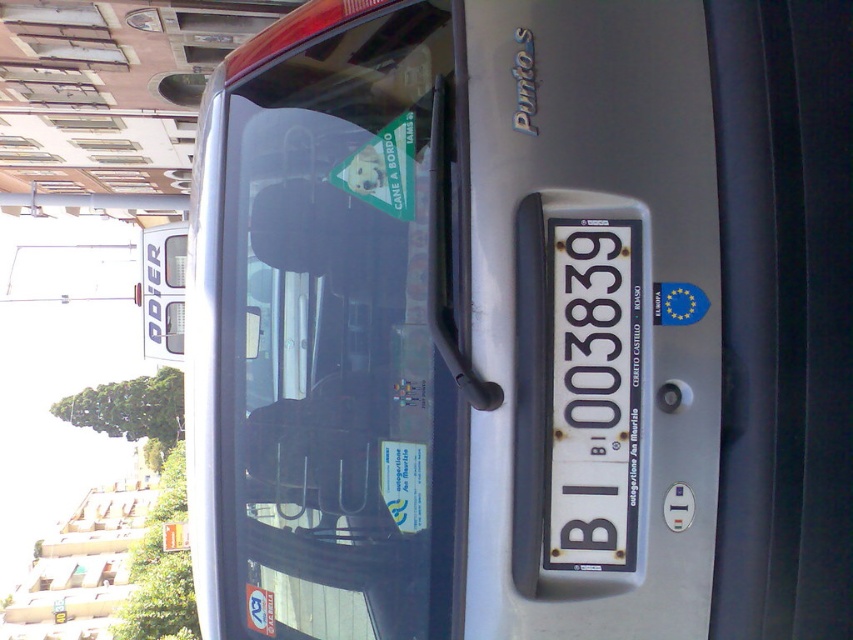
You are a parking attendant checking the license plate and sticker on a car. The car has a white metallic license plate at center and a white paper sticker at center. According to the rules, the license plate must be to the left of the sticker. Is this car compliant with the rule?

The white metallic license plate at center is positioned on the right side of white paper sticker at center, so it is not compliant with the rule that requires the license plate to be to the left of the sticker.

You are a delivery person who needs to confirm the license plate number of the car. You see the white metallic license plate at center and the white paper sticker at center. Which one is higher up?

The white metallic license plate at center is above the white paper sticker at center, so the license plate is higher up.

You are standing in front of the silver car and looking at its rear. There are two points marked on the car. The first point is at coordinates point (303, 294) and the second is at point (413, 467). Which point is closer to you?

Point (303, 294) is further to the viewer than point (413, 467), so the point closer to you is point (413, 467).